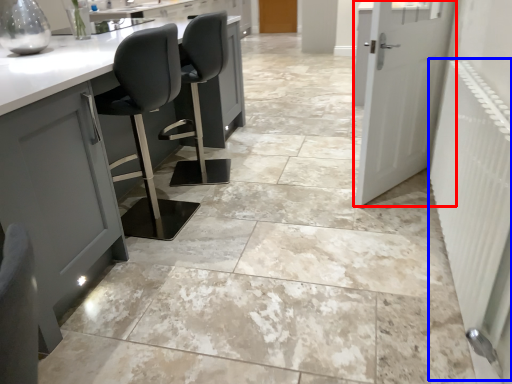
Question: Which of the following is the farthest to the observer, door (highlighted by a red box) or radiator (highlighted by a blue box)?

Choices:
 (A) door
 (B) radiator

Answer: (A)